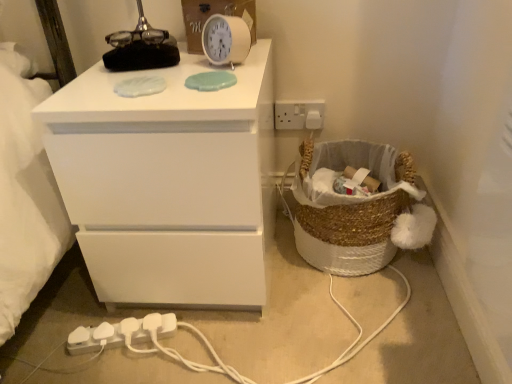
Question: In terms of height, does white plastic clock at upper center look taller or shorter compared to white plastic extension cord at lower left?

Choices:
 (A) tall
 (B) short

Answer: (A)

Question: Is point (233, 51) closer or farther from the camera than point (75, 334)?

Choices:
 (A) farther
 (B) closer

Answer: (B)

Question: Which is farther from the braided wicker basket at lower right?

Choices:
 (A) white plastic electrical outlet at upper right
 (B) white plastic extension cord at lower left
 (C) white plastic clock at upper center
 (D) white matte chest of drawers at upper left

Answer: (B)

Question: Estimate the real-world distances between objects in this image. Which object is farther from the white plastic electrical outlet at upper right?

Choices:
 (A) braided wicker basket at lower right
 (B) white plastic clock at upper center
 (C) white matte chest of drawers at upper left
 (D) white plastic extension cord at lower left

Answer: (D)